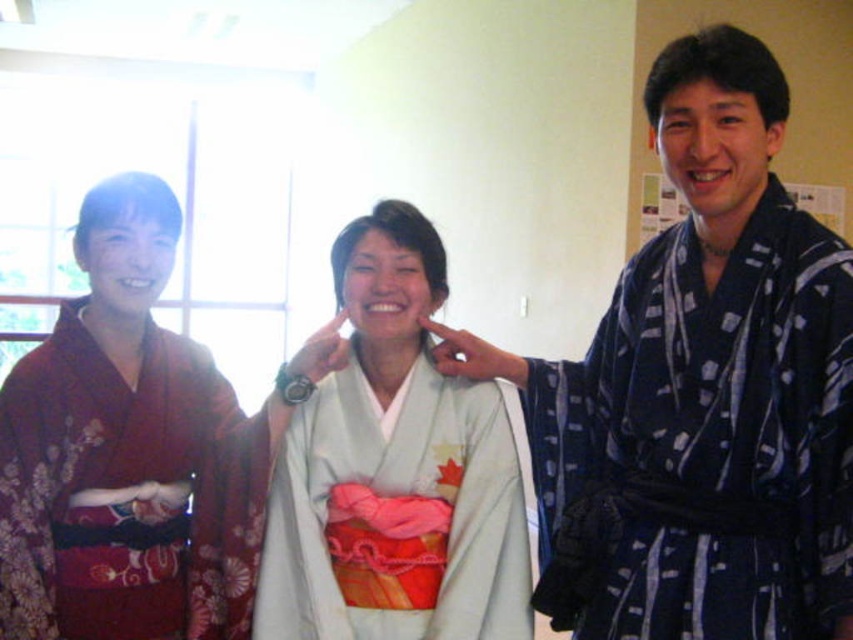
Is blue printed robe at right to the right of white silk kimono at center from the viewer's perspective?

Correct, you'll find blue printed robe at right to the right of white silk kimono at center.

Does blue printed robe at right have a smaller size compared to white silk kimono at center?

No.

Find the location of `blue printed robe at right`. blue printed robe at right is located at coordinates (703, 444).

Can you confirm if blue printed robe at right is positioned above matte red kimono at left?

Indeed, blue printed robe at right is positioned over matte red kimono at left.

This screenshot has width=853, height=640. What do you see at coordinates (703, 444) in the screenshot? I see `blue printed robe at right` at bounding box center [703, 444].

Measure the distance between point (666, 348) and camera.

Point (666, 348) and camera are 4.94 feet apart.

Locate an element on the screen. This screenshot has width=853, height=640. blue printed robe at right is located at coordinates (703, 444).

Can you confirm if white silk kimono at center is positioned to the right of matte red kimono at left?

Yes, white silk kimono at center is to the right of matte red kimono at left.

Is white silk kimono at center wider than matte red kimono at left?

Yes.

Does point (482, 600) lie behind point (241, 436)?

No, (482, 600) is closer to viewer.

You are a GUI agent. You are given a task and a screenshot of the screen. Output one action in this format:
    pyautogui.click(x=<x>, y=<y>)
    Task: Click on the white silk kimono at center
    This screenshot has width=853, height=640.
    Given the screenshot: What is the action you would take?
    pyautogui.click(x=393, y=468)